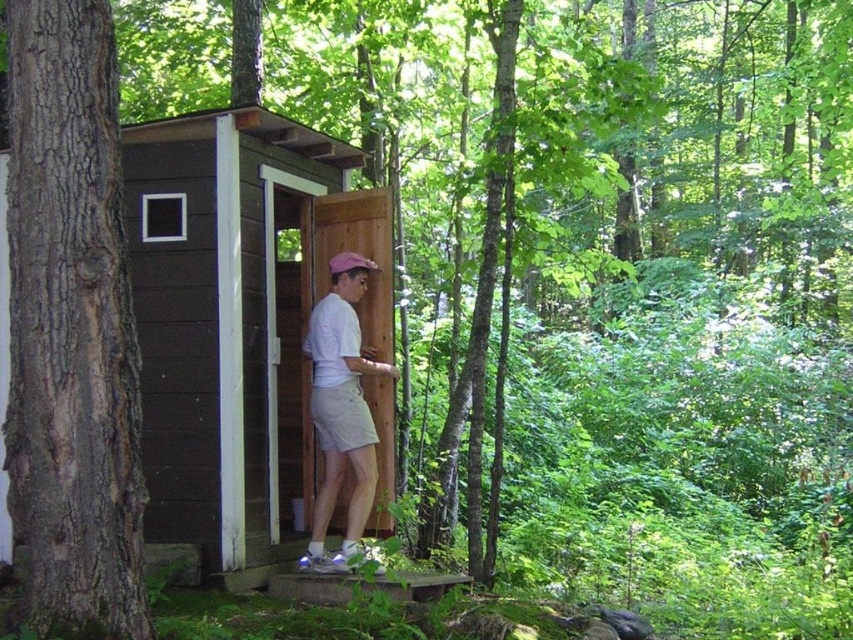
Looking at this image, you are a hiker who just arrived at the brown wood cabin at center and the pink fabric baseball cap at center. Which object is positioned lower in the image?

The brown wood cabin at center is located below the pink fabric baseball cap at center, so the brown wood cabin at center is positioned lower in the image.